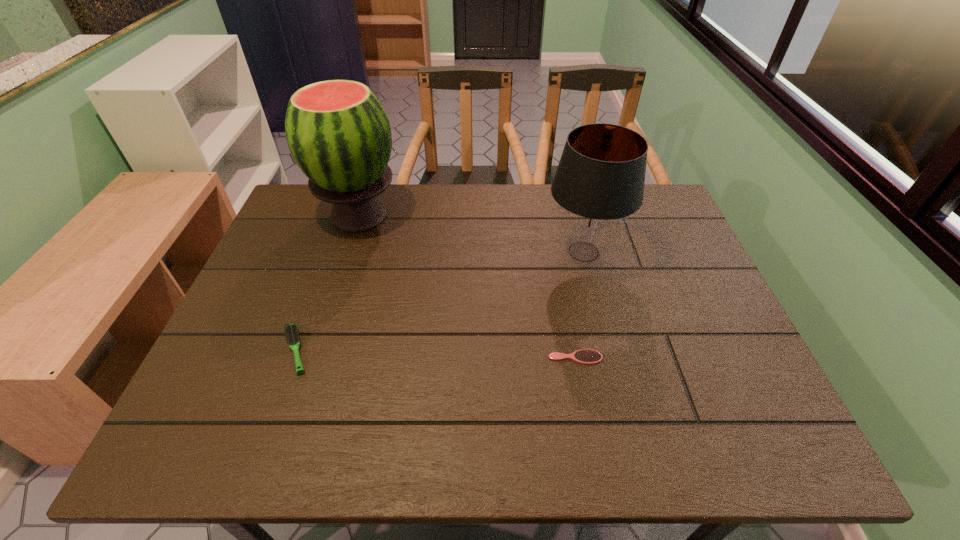
The width and height of the screenshot is (960, 540). What are the coordinates of `empty location between the left hairbrush and the watermelon` in the screenshot? It's located at (327, 283).

In order to click on object that stands as the second closest to the watermelon in this screenshot , I will do `click(599, 182)`.

At what (x,y) coordinates should I click in order to perform the action: click on object that can be found as the closest to the lampshade. Please return your answer as a coordinate pair (x, y). The width and height of the screenshot is (960, 540). Looking at the image, I should click on coord(585,356).

Find the location of `blank space that satisfies the following two spatial constraints: 1. on the front side of the right hairbrush; 2. on the left side of the third tallest object`. blank space that satisfies the following two spatial constraints: 1. on the front side of the right hairbrush; 2. on the left side of the third tallest object is located at coordinates (293, 357).